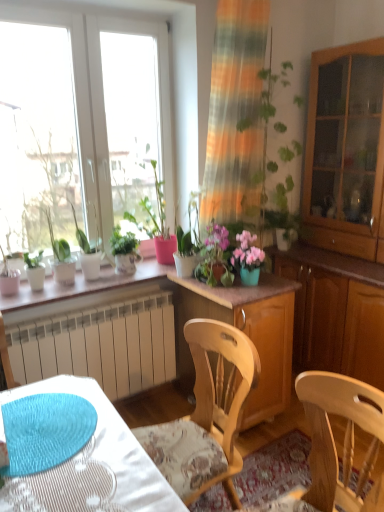
Question: Could you tell me if wooden cabinet at right, the second cabinetry positioned from the left, is turned towards green matte plant at upper left, the 1th houseplant from the right?

Choices:
 (A) no
 (B) yes

Answer: (B)

Question: Considering the relative positions of wooden cabinet at right, which ranks as the 2th cabinetry in bottom-to-top order, and green matte plant at upper left, the 1th houseplant from the right, in the image provided, is wooden cabinet at right, which ranks as the 2th cabinetry in bottom-to-top order, to the right of green matte plant at upper left, the 1th houseplant from the right, from the viewer's perspective?

Choices:
 (A) yes
 (B) no

Answer: (A)

Question: Is wooden cabinet at right, the 1th cabinetry from the right, further to camera compared to green matte plant at upper left, the 1th houseplant from the right?

Choices:
 (A) no
 (B) yes

Answer: (A)

Question: Is wooden cabinet at right, which ranks as the 2th cabinetry in bottom-to-top order, taller than green matte plant at upper left, the 1th houseplant from the right?

Choices:
 (A) no
 (B) yes

Answer: (B)

Question: From the image's perspective, is wooden cabinet at right, which ranks as the 2th cabinetry in bottom-to-top order, below green matte plant at upper left, positioned as the 2th houseplant in left-to-right order?

Choices:
 (A) yes
 (B) no

Answer: (B)

Question: In terms of size, does pink matte flower pot at center appear bigger or smaller than green matte plant at upper left, the 1th houseplant from the right?

Choices:
 (A) small
 (B) big

Answer: (A)

Question: From a real-world perspective, relative to green matte plant at upper left, positioned as the 2th houseplant in left-to-right order, is pink matte flower pot at center vertically above or below?

Choices:
 (A) above
 (B) below

Answer: (B)

Question: Relative to green matte plant at upper left, the 1th houseplant from the right, is pink matte flower pot at center in front or behind?

Choices:
 (A) front
 (B) behind

Answer: (B)

Question: Is point (240, 246) closer or farther from the camera than point (81, 243)?

Choices:
 (A) closer
 (B) farther

Answer: (A)

Question: From the image's perspective, is wooden chair at center above or below wooden cabinet at right?

Choices:
 (A) above
 (B) below

Answer: (B)

Question: Is wooden chair at center spatially inside wooden cabinet at right, or outside of it?

Choices:
 (A) outside
 (B) inside

Answer: (A)

Question: Considering the positions of wooden chair at center and wooden cabinet at right in the image, is wooden chair at center bigger or smaller than wooden cabinet at right?

Choices:
 (A) small
 (B) big

Answer: (A)

Question: In terms of height, does wooden chair at center look taller or shorter compared to wooden cabinet at right?

Choices:
 (A) short
 (B) tall

Answer: (B)

Question: Relative to green matte plant at upper left, positioned as the 2th houseplant in left-to-right order, is wooden cabinet at right, which ranks as the 2th cabinetry in bottom-to-top order, in front or behind?

Choices:
 (A) front
 (B) behind

Answer: (A)

Question: Does point (324, 137) appear closer or farther from the camera than point (84, 237)?

Choices:
 (A) closer
 (B) farther

Answer: (B)